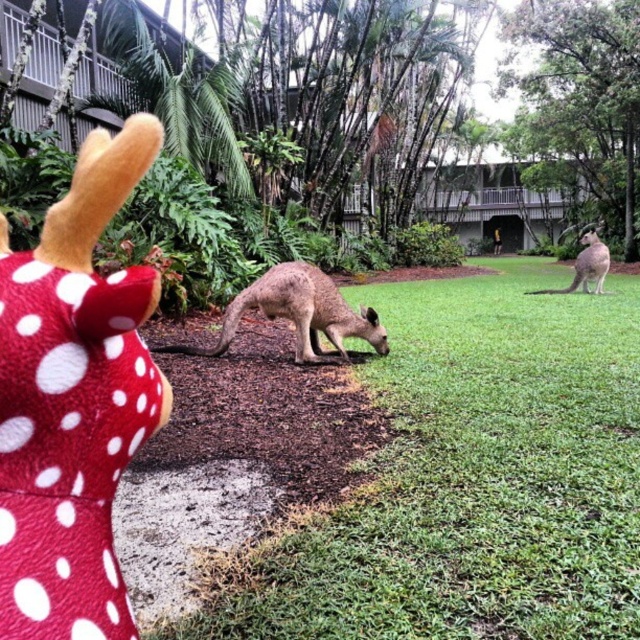
You are a photographer trying to capture a photo of the brown fur kangaroo at right without the green grass at center in the background. Can you move back enough to ensure the kangaroo is in focus while the grass is blurred?

The green grass at center and brown fur kangaroo at right are 20.16 feet apart. To blur the background, you need to ensure the distance between the subject and background is large enough. Since they are over 20 feet apart, moving back and using a wide aperture should allow the kangaroo to be in focus with the grass blurred.

You are a photographer trying to capture a clear photo of the kangaroos. The green grass at center and the light brown fur at center are both in your frame. Considering the camera has a depth of field that can focus sharply on objects within 80 centimeters of each other, will both subjects be in focus?

The distance between the green grass at center and light brown fur at center is 86.14 centimeters. Since this exceeds the camera depth of field range of 80 centimeters, only one of the subjects will be in focus, not both.

You are a photographer trying to capture the kangaroos in the scene. You notice the green grass at center and the light brown fur at center. Which one is closer to the camera?

The green grass at center is closer to the camera because it is in front of the light brown fur at center.